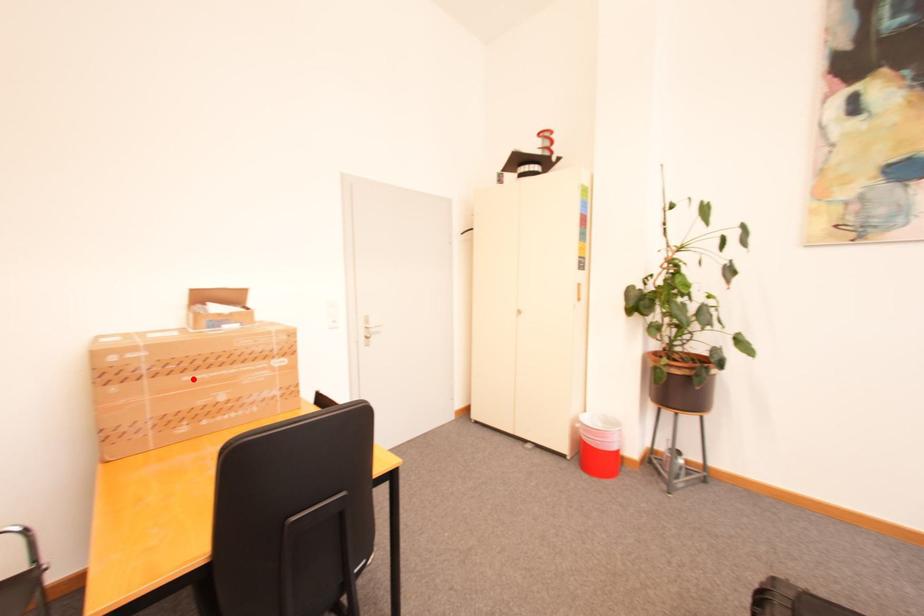
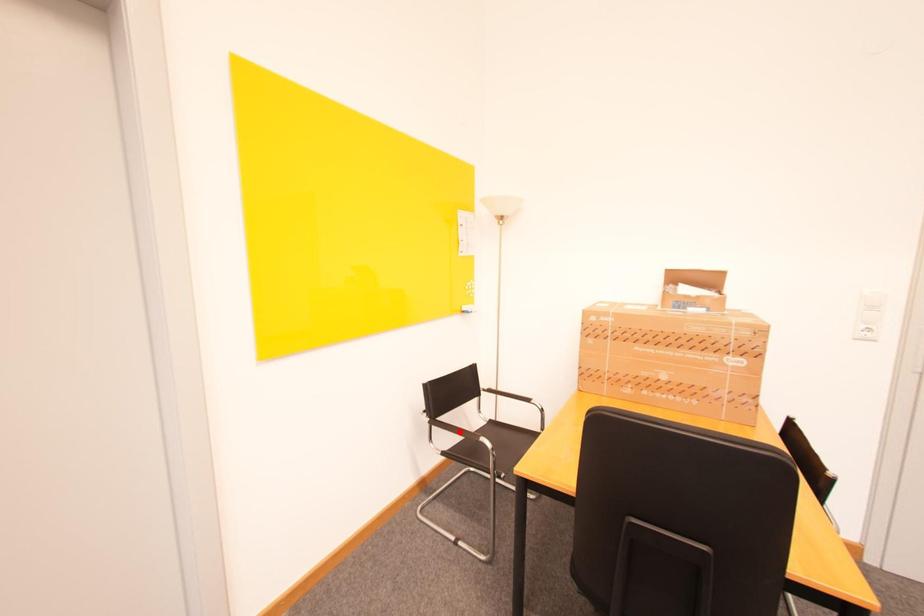
I am providing you with two images of the same scene from different viewpoints. A red point is marked on the first image and another point is marked on the second image. Do the highlighted points in image1 and image2 indicate the same real-world spot?

No